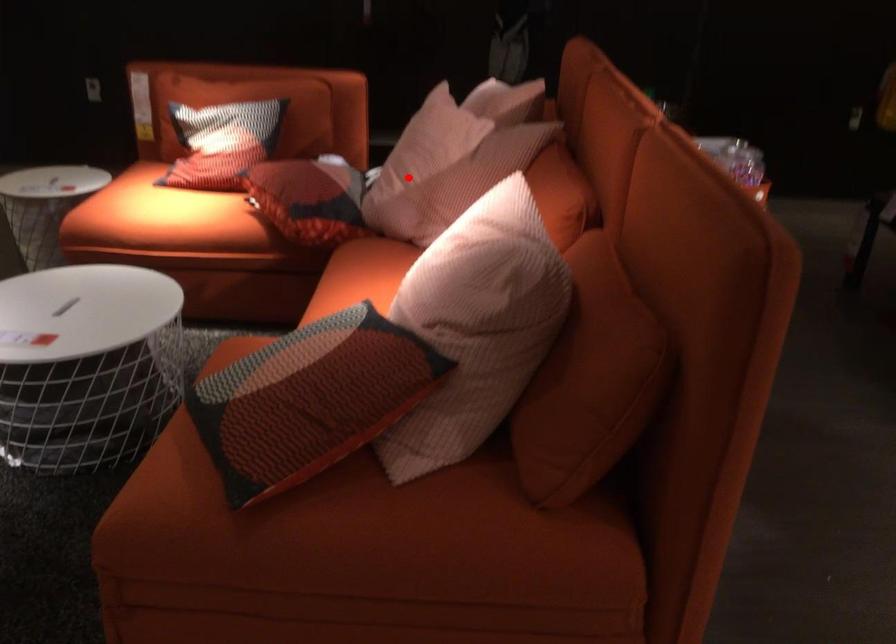
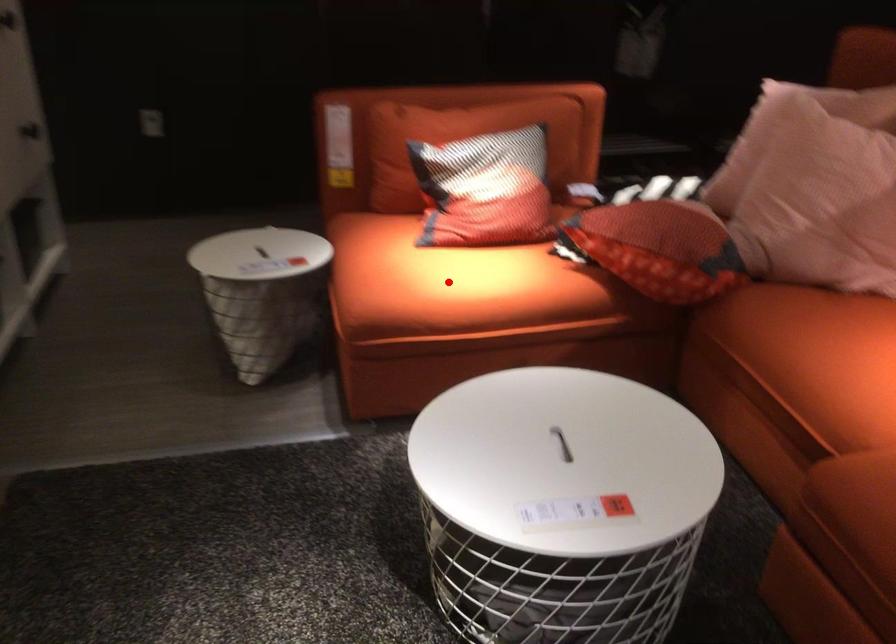
I am providing you with two images of the same scene from different viewpoints. A red point is marked on the first image and another point is marked on the second image. Is the marked point in image1 the same physical position as the marked point in image2?

No